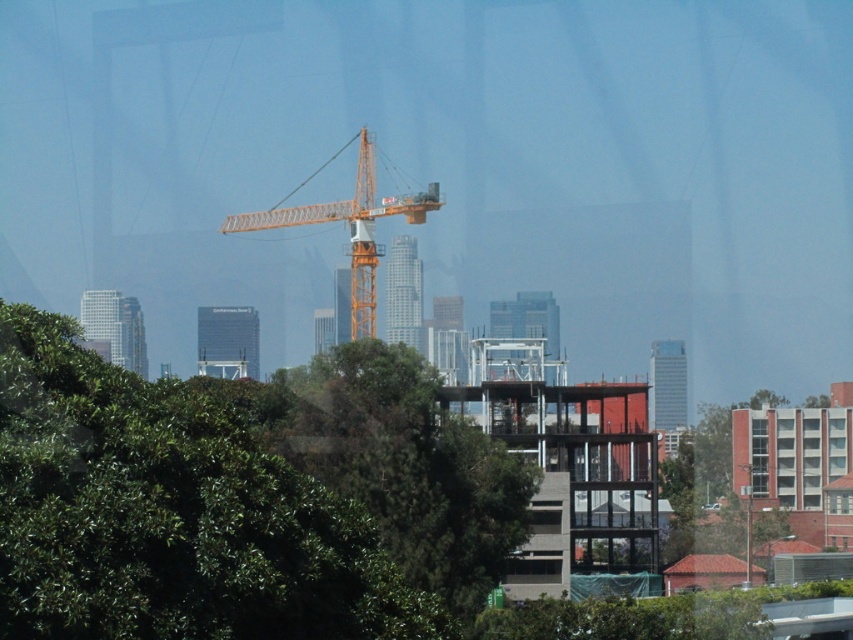
Is green leafy tree at center positioned in front of orange metallic crane at center?

Yes.

Which is behind, point (225, 625) or point (254, 211)?

The point (254, 211) is behind.

This screenshot has width=853, height=640. I want to click on green leafy tree at center, so click(x=169, y=515).

Where is `green leafy tree at center`? This screenshot has height=640, width=853. green leafy tree at center is located at coordinates (169, 515).